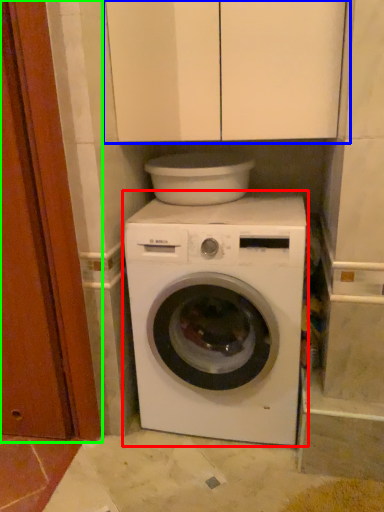
Question: Which is farther away from washing machine (highlighted by a red box)? cabinetry (highlighted by a blue box) or door (highlighted by a green box)?

Choices:
 (A) cabinetry
 (B) door

Answer: (A)